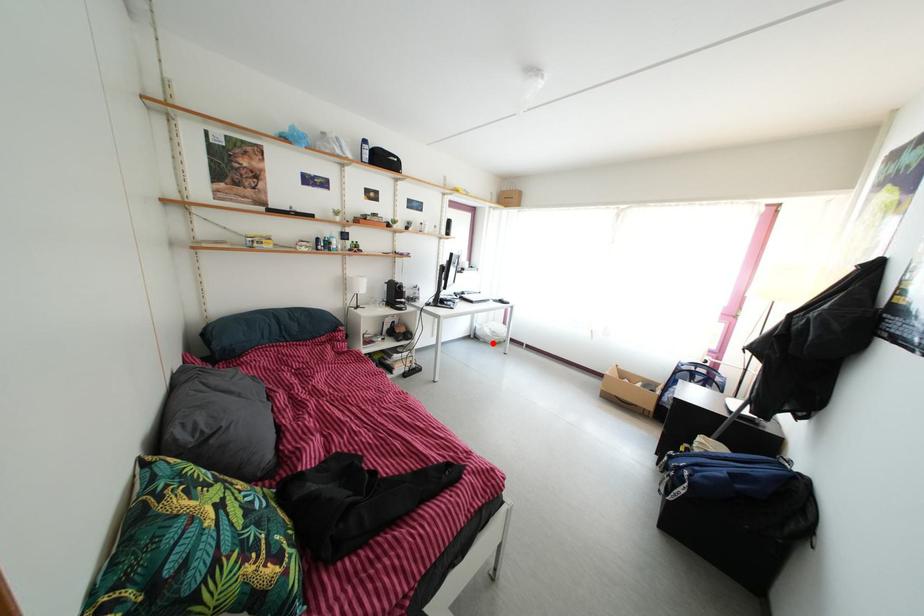
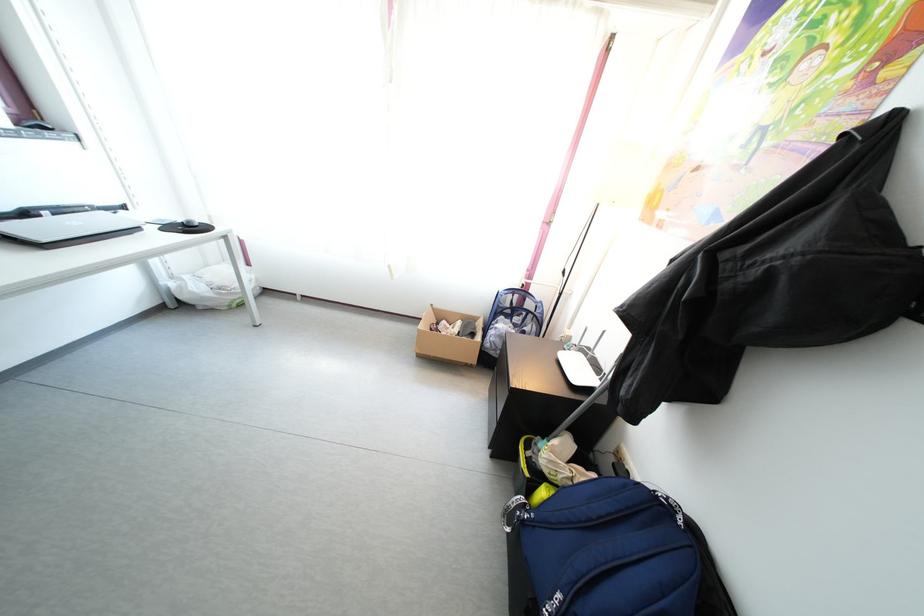
Question: A red point is marked in image1. In image2, is the corresponding 3D point closer to the camera or farther? Reply with the corresponding letter.

Choices:
 (A) The corresponding 3D point is closer.
 (B) The corresponding 3D point is farther.

Answer: (A)